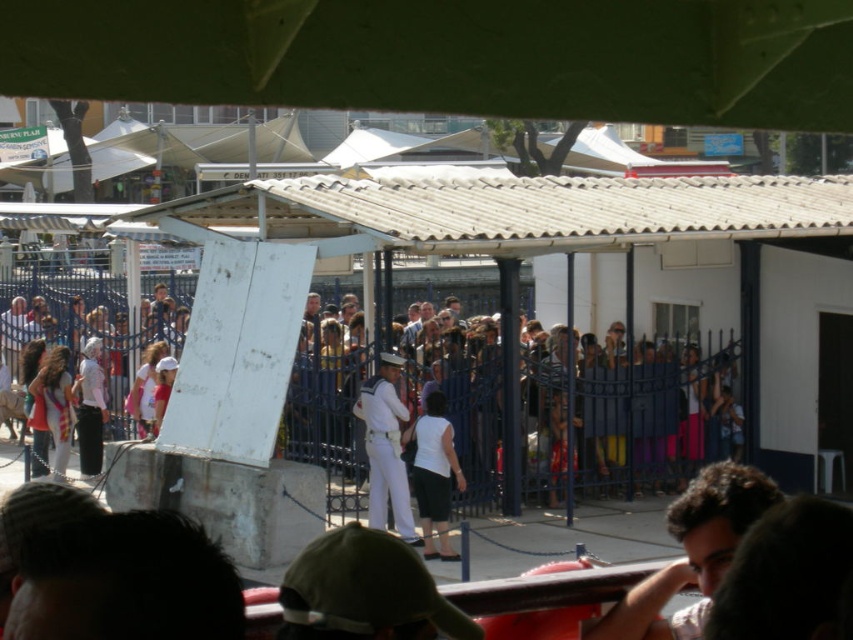
Can you confirm if white matte crowd at center is shorter than white cotton shirt at left?

No, white matte crowd at center is not shorter than white cotton shirt at left.

Which of these two, white matte crowd at center or white cotton shirt at left, stands shorter?

white cotton shirt at left is shorter.

The image size is (853, 640). What do you see at coordinates (651, 413) in the screenshot? I see `white matte crowd at center` at bounding box center [651, 413].

Find the location of a particular element. This screenshot has height=640, width=853. white matte crowd at center is located at coordinates (651, 413).

Which is below, white matte crowd at center or white matte skirt at center?

white matte skirt at center is below.

In the scene shown: Who is more distant from viewer, (578, 417) or (431, 448)?

The point (578, 417) is behind.

Looking at this image, who is more distant from viewer, (483, 444) or (440, 413)?

Point (483, 444)

The width and height of the screenshot is (853, 640). In order to click on white matte crowd at center in this screenshot , I will do `click(651, 413)`.

Which is below, white matte crowd at center or brown hair at lower right?

Positioned lower is brown hair at lower right.

Describe the element at coordinates (651, 413) in the screenshot. I see `white matte crowd at center` at that location.

Identify the location of white matte crowd at center. The width and height of the screenshot is (853, 640). [651, 413].